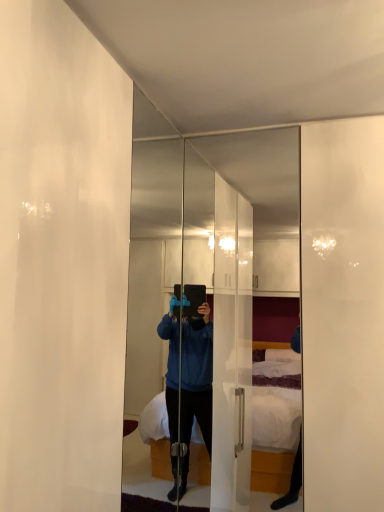
Identify the location of transparent glass mirror at center. (217, 282).

Measure the distance between point (x=134, y=202) and camera.

A: 3.13 meters.

Describe the element at coordinates (217, 282) in the screenshot. The width and height of the screenshot is (384, 512). I see `transparent glass mirror at center` at that location.

This screenshot has height=512, width=384. In order to click on transparent glass mirror at center in this screenshot , I will do `click(217, 282)`.